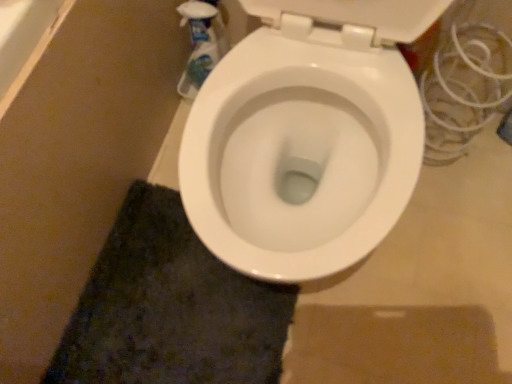
At what (x,y) coordinates should I click in order to perform the action: click on free space underneath dark green shaggy carpet at lower left (from a real-world perspective). Please return your answer as a coordinate pair (x, y). The width and height of the screenshot is (512, 384). Looking at the image, I should click on (189, 335).